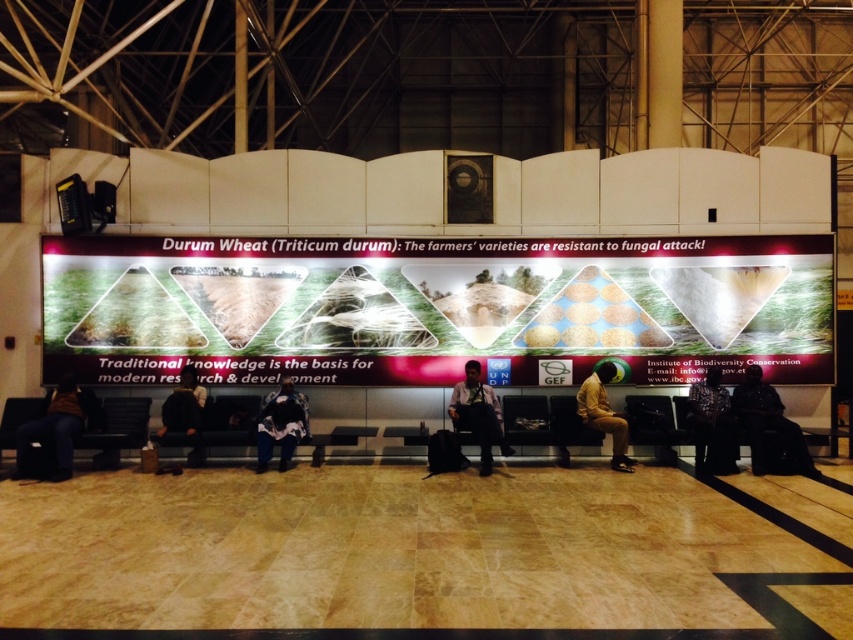
Who is taller, dark brown leather jacket at lower right or dark brown leather jacket at lower left?

dark brown leather jacket at lower right is taller.

Does dark brown leather jacket at lower right have a greater width compared to dark brown leather jacket at lower left?

Correct, the width of dark brown leather jacket at lower right exceeds that of dark brown leather jacket at lower left.

Find the location of a particular element. The width and height of the screenshot is (853, 640). dark brown leather jacket at lower right is located at coordinates (767, 420).

Does point (753, 376) come in front of point (289, 410)?

That is False.

Is dark brown leather jacket at lower right closer to camera compared to dark blue fabric jacket at center?

Yes, dark brown leather jacket at lower right is closer to the viewer.

The image size is (853, 640). Find the location of `dark brown leather jacket at lower right`. dark brown leather jacket at lower right is located at coordinates (767, 420).

Is matte pink poster at center to the right of light blue shirt at center from the viewer's perspective?

In fact, matte pink poster at center is to the left of light blue shirt at center.

Is point (132, 268) less distant than point (479, 378)?

No, (132, 268) is further to viewer.

I want to click on matte pink poster at center, so (434, 307).